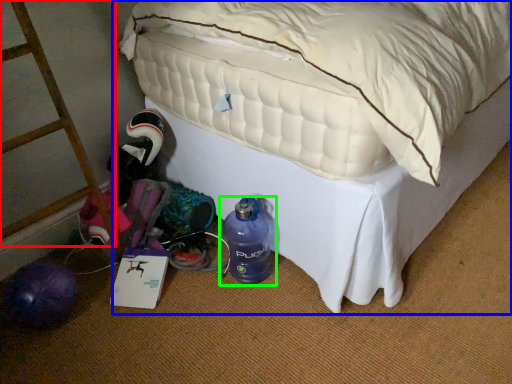
Question: Which object is positioned closest to ladder (highlighted by a red box)? Select from bed (highlighted by a blue box) and bottle (highlighted by a green box).

Choices:
 (A) bed
 (B) bottle

Answer: (B)